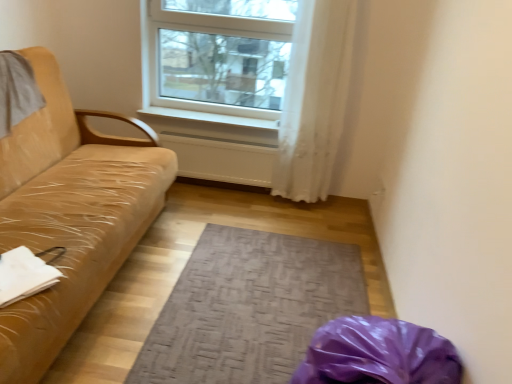
At what (x,y) coordinates should I click in order to perform the action: click on white smooth window sill at center. Please return your answer as a coordinate pair (x, y). The width and height of the screenshot is (512, 384). Looking at the image, I should click on (210, 117).

This screenshot has height=384, width=512. What do you see at coordinates (210, 117) in the screenshot? I see `white smooth window sill at center` at bounding box center [210, 117].

Image resolution: width=512 pixels, height=384 pixels. Describe the element at coordinates (249, 308) in the screenshot. I see `textured gray mat at center` at that location.

I want to click on white sheer curtain at upper center, so click(x=314, y=99).

Identify the location of white smooth window sill at center. This screenshot has width=512, height=384. (210, 117).

From a real-world perspective, which is physically below, tan leather couch at left or white plastic window at upper center?

tan leather couch at left, from a real-world perspective.

Considering the relative sizes of tan leather couch at left and white plastic window at upper center in the image provided, is tan leather couch at left wider than white plastic window at upper center?

Yes, tan leather couch at left is wider than white plastic window at upper center.

Is point (49, 70) less distant than point (266, 3)?

Yes, it is in front of point (266, 3).

Is tan leather couch at left aimed at white plastic window at upper center?

No.

Is white smooth window sill at center with white plastic window at upper center?

No, white smooth window sill at center is not touching white plastic window at upper center.

From the picture: Between white smooth window sill at center and white plastic window at upper center, which one has larger size?

Bigger between the two is white plastic window at upper center.

Is white smooth window sill at center thinner than white plastic window at upper center?

No, white smooth window sill at center is not thinner than white plastic window at upper center.

Could you tell me if white sheer curtain at upper center is turned towards tan leather couch at left?

No.

Which is less distant, [322,186] or [100,238]?

Point [322,186] appears to be farther away from the viewer than point [100,238].

Consider the image. Is white sheer curtain at upper center positioned far away from tan leather couch at left?

That's right, there is a large distance between white sheer curtain at upper center and tan leather couch at left.

Is white sheer curtain at upper center not within tan leather couch at left?

Yes, white sheer curtain at upper center is not within tan leather couch at left.

Is point (208, 250) positioned before point (329, 166)?

Yes, it is in front of point (329, 166).

I want to click on curtain above the textured gray mat at center (from the image's perspective), so (x=314, y=99).

Based on the photo, who is taller, textured gray mat at center or white sheer curtain at upper center?

Standing taller between the two is white sheer curtain at upper center.

Is white smooth window sill at center positioned far away from tan leather couch at left?

Yes.

Between white smooth window sill at center and tan leather couch at left, which one has smaller width?

Thinner between the two is white smooth window sill at center.

Does white smooth window sill at center lie behind tan leather couch at left?

Yes, white smooth window sill at center is further from the camera.

From a real-world perspective, is white smooth window sill at center physically located above or below tan leather couch at left?

white smooth window sill at center is above tan leather couch at left.

Does white smooth window sill at center contain textured gray mat at center?

No, textured gray mat at center is not a part of white smooth window sill at center.

Does white smooth window sill at center have a greater width compared to textured gray mat at center?

No.

Between white smooth window sill at center and textured gray mat at center, which one is positioned behind?

Positioned behind is white smooth window sill at center.

From a real-world perspective, does white sheer curtain at upper center stand above white plastic window at upper center?

Actually, white sheer curtain at upper center is physically below white plastic window at upper center in the real world.

Is white sheer curtain at upper center surrounding white plastic window at upper center?

No, white plastic window at upper center is not inside white sheer curtain at upper center.

From the image's perspective, relative to white plastic window at upper center, is white sheer curtain at upper center above or below?

white sheer curtain at upper center is below white plastic window at upper center.

What are the coordinates of `window positioned vertically above the tan leather couch at left (from a real-world perspective)` in the screenshot? It's located at [x=219, y=56].

Where is `window sill below the white plastic window at upper center (from the image's perspective)`? The height and width of the screenshot is (384, 512). window sill below the white plastic window at upper center (from the image's perspective) is located at coordinates (210, 117).

Which object lies further to the anchor point white smooth window sill at center, white sheer curtain at upper center or tan leather couch at left?

tan leather couch at left.

When comparing their distances from textured gray mat at center, does white smooth window sill at center or white plastic window at upper center seem closer?

The object closer to textured gray mat at center is white smooth window sill at center.

From the image, which object appears to be farther from textured gray mat at center, white sheer curtain at upper center or tan leather couch at left?

white sheer curtain at upper center is further to textured gray mat at center.

Which object lies nearer to the anchor point white smooth window sill at center, white plastic window at upper center or white sheer curtain at upper center?

Among the two, white plastic window at upper center is located nearer to white smooth window sill at center.

Based on the photo, which object lies further to the anchor point textured gray mat at center, white plastic window at upper center or tan leather couch at left?

white plastic window at upper center is positioned further to the anchor textured gray mat at center.

Which object lies nearer to the anchor point white plastic window at upper center, textured gray mat at center or white smooth window sill at center?

white smooth window sill at center.

Looking at the image, which one is located further to white smooth window sill at center, white plastic window at upper center or tan leather couch at left?

tan leather couch at left is positioned further to the anchor white smooth window sill at center.

Based on their spatial positions, is white plastic window at upper center or white smooth window sill at center closer to tan leather couch at left?

Based on the image, white plastic window at upper center appears to be nearer to tan leather couch at left.

Find the location of a particular element. mat located between tan leather couch at left and white smooth window sill at center in the depth direction is located at coordinates (249, 308).

This screenshot has height=384, width=512. In order to click on window located between tan leather couch at left and white smooth window sill at center in the depth direction in this screenshot , I will do `click(219, 56)`.

Locate an element on the screen. The image size is (512, 384). curtain positioned between textured gray mat at center and white smooth window sill at center from near to far is located at coordinates (314, 99).

This screenshot has width=512, height=384. What are the coordinates of `window between white smooth window sill at center and white sheer curtain at upper center` in the screenshot? It's located at [x=219, y=56].